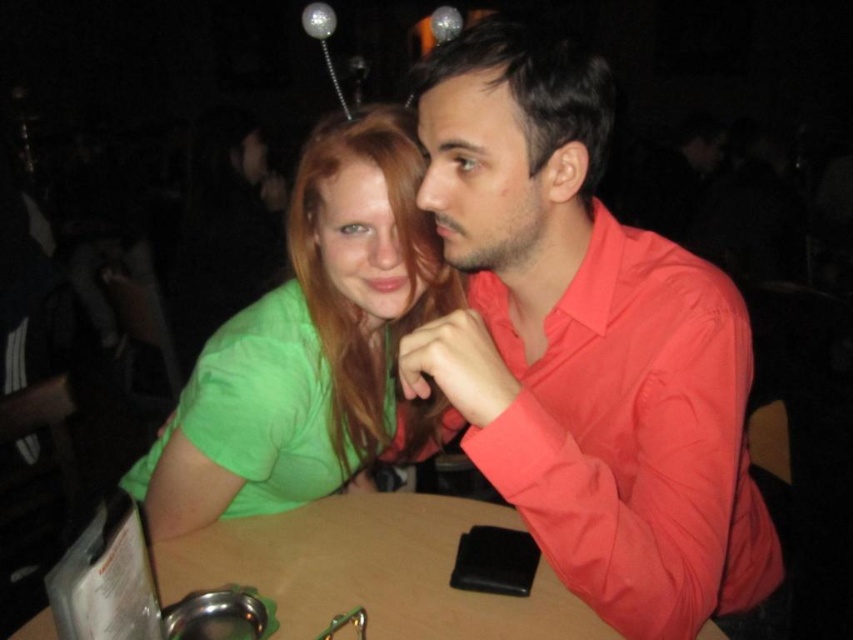
Question: Based on their relative distances, which object is farther from the brown wooden table at center?

Choices:
 (A) green matte shirt at center
 (B) matte red shirt at center

Answer: (B)

Question: Is matte red shirt at center smaller than green matte shirt at center?

Choices:
 (A) no
 (B) yes

Answer: (A)

Question: Can you confirm if matte red shirt at center is wider than brown wooden table at center?

Choices:
 (A) yes
 (B) no

Answer: (B)

Question: Is matte red shirt at center smaller than brown wooden table at center?

Choices:
 (A) yes
 (B) no

Answer: (B)

Question: Which of the following is the closest to the observer?

Choices:
 (A) (410, 422)
 (B) (630, 518)

Answer: (B)

Question: Which of the following is the farthest from the observer?

Choices:
 (A) (456, 604)
 (B) (616, 449)
 (C) (277, 296)

Answer: (C)